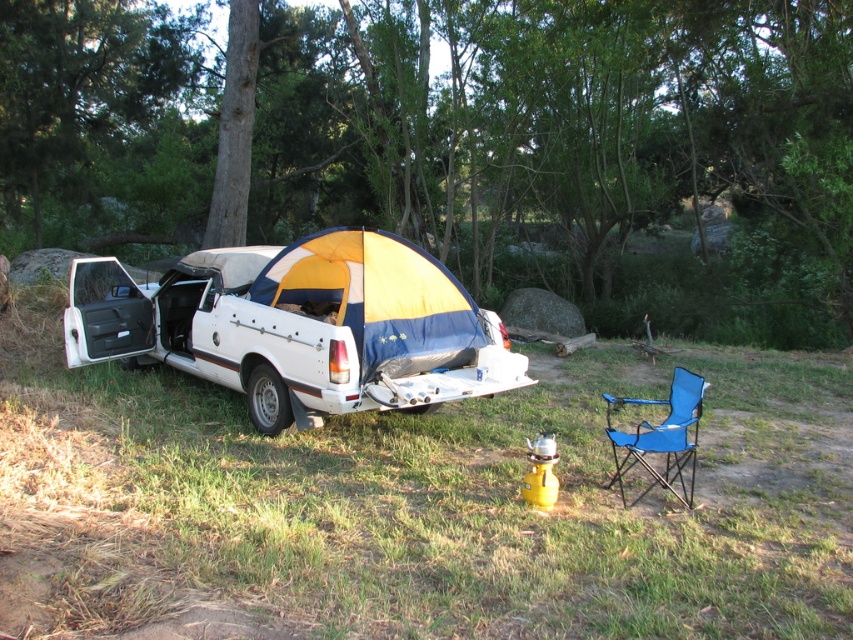
Is green leafy tree at upper center shorter than white matte car at center?

No, green leafy tree at upper center is not shorter than white matte car at center.

Measure the distance between green leafy tree at upper center and white matte car at center.

green leafy tree at upper center is 13.61 meters from white matte car at center.

Where is `green leafy tree at upper center`? This screenshot has height=640, width=853. green leafy tree at upper center is located at coordinates click(x=457, y=144).